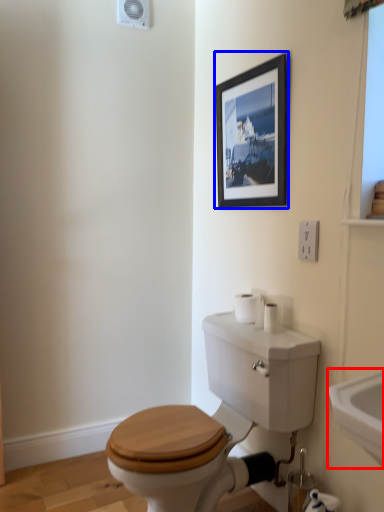
Question: Among these objects, which one is farthest to the camera, sink (highlighted by a red box) or picture frame (highlighted by a blue box)?

Choices:
 (A) sink
 (B) picture frame

Answer: (B)